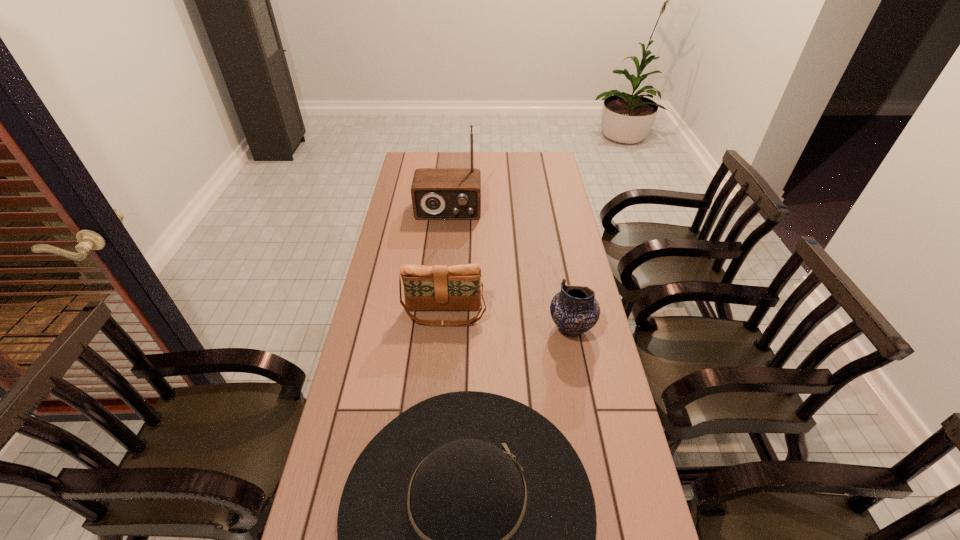
The height and width of the screenshot is (540, 960). Identify the location of the tallest object. (437, 193).

Where is `the farthest object`? The image size is (960, 540). the farthest object is located at coordinates (437, 193).

The height and width of the screenshot is (540, 960). I want to click on shoulder bag, so click(438, 287).

You are a GUI agent. You are given a task and a screenshot of the screen. Output one action in this format:
    pyautogui.click(x=<x>, y=<y>)
    Task: Click on the pottery
    
    Given the screenshot: What is the action you would take?
    pyautogui.click(x=575, y=310)

Identify the location of vacant space located on the front-facing side of the tallest object. The height and width of the screenshot is (540, 960). (443, 272).

Locate an element on the screen. This screenshot has height=540, width=960. free region located on the front-facing side of the shoulder bag is located at coordinates (439, 388).

Image resolution: width=960 pixels, height=540 pixels. I want to click on vacant position located on the left of the pottery, so click(430, 328).

Identify the location of radio receiver at the left edge. (437, 193).

What are the coordinates of `shoulder bag at the left edge` in the screenshot? It's located at (438, 287).

You are a GUI agent. You are given a task and a screenshot of the screen. Output one action in this format:
    pyautogui.click(x=<x>, y=<y>)
    Task: Click on the object situated at the right edge
    The height and width of the screenshot is (540, 960).
    Given the screenshot: What is the action you would take?
    pyautogui.click(x=575, y=310)